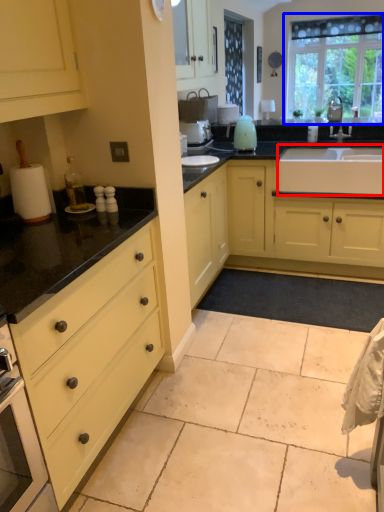
Question: Among these objects, which one is nearest to the camera, sink (highlighted by a red box) or window (highlighted by a blue box)?

Choices:
 (A) sink
 (B) window

Answer: (A)